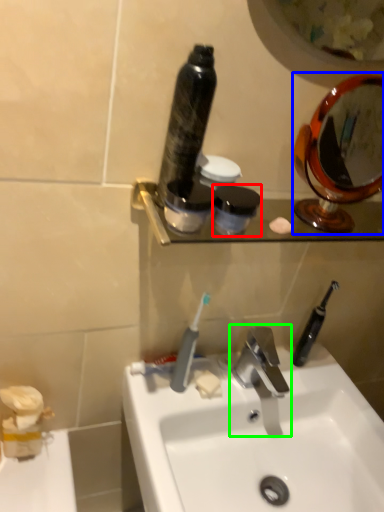
Question: Which object is the closest to the mouthwash (highlighted by a red box)? Choose among these: mirror (highlighted by a blue box) or tap (highlighted by a green box).

Choices:
 (A) mirror
 (B) tap

Answer: (B)